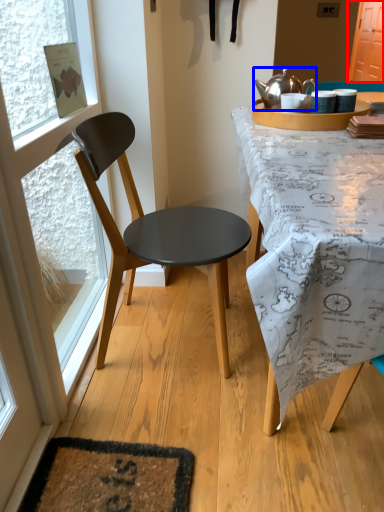
Question: Which object is closer to the camera taking this photo, screen door (highlighted by a red box) or kettle (highlighted by a blue box)?

Choices:
 (A) screen door
 (B) kettle

Answer: (B)